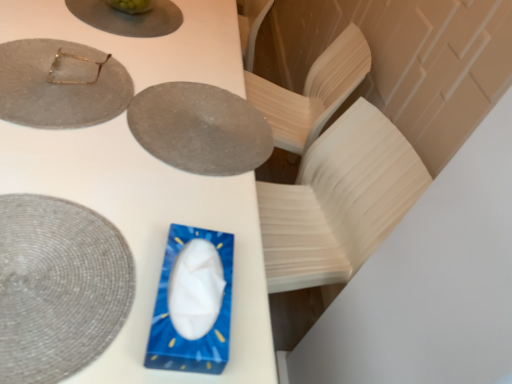
Question: Considering the positions of matte gray plate at upper center, positioned as the 1th plate in top-to-bottom order, and matte gray placemat at lower left, arranged as the 4th plate when viewed from the top, in the image, is matte gray plate at upper center, positioned as the 1th plate in top-to-bottom order, bigger or smaller than matte gray placemat at lower left, arranged as the 4th plate when viewed from the top,?

Choices:
 (A) small
 (B) big

Answer: (A)

Question: Considering the positions of matte gray plate at upper center, positioned as the 1th plate in top-to-bottom order, and matte gray placemat at lower left, arranged as the 4th plate when viewed from the top, in the image, is matte gray plate at upper center, positioned as the 1th plate in top-to-bottom order, wider or thinner than matte gray placemat at lower left, arranged as the 4th plate when viewed from the top,?

Choices:
 (A) thin
 (B) wide

Answer: (B)

Question: Which object is positioned farthest from the matte gray plate at upper center, positioned as the 1th plate in top-to-bottom order?

Choices:
 (A) matte gray plate at upper center, placed as the third plate when sorted from top to bottom
 (B) matte gray placemat at upper left, which appears as the third plate when ordered from the bottom
 (C) blue plastic tissue box at center
 (D) matte gray placemat at lower left, arranged as the 4th plate when viewed from the top
 (E) gold metallic glasses at upper left

Answer: (D)

Question: Estimate the real-world distances between objects in this image. Which object is farther from the gold metallic glasses at upper left?

Choices:
 (A) matte gray plate at upper center, positioned as the 1th plate in top-to-bottom order
 (B) blue plastic tissue box at center
 (C) matte gray plate at upper center, the second plate positioned from the bottom
 (D) matte gray placemat at upper left, acting as the 2th plate starting from the top
 (E) matte gray placemat at lower left, arranged as the 4th plate when viewed from the top

Answer: (E)